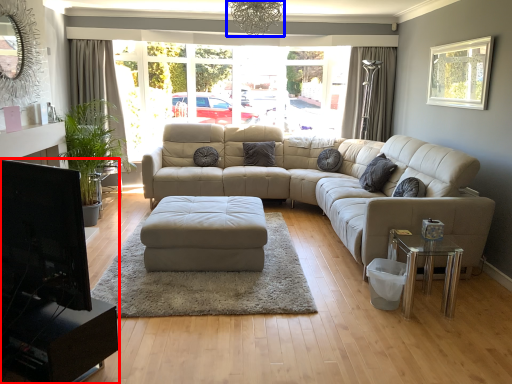
Question: Which of the following is the closest to the observer, entertainment center (highlighted by a red box) or light fixture (highlighted by a blue box)?

Choices:
 (A) entertainment center
 (B) light fixture

Answer: (A)